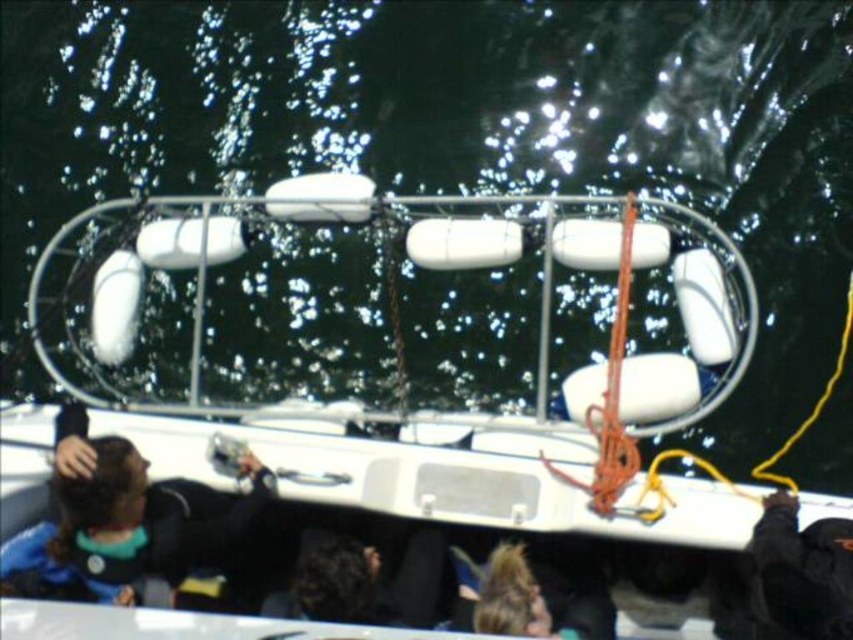
You are a passenger on the boat and want to retrieve your blue fabric jacket at lower left. However, there are white matte lifebuoys at center blocking your path. Can you walk around them to reach your jacket?

The white matte lifebuoys at center are in front of the blue fabric jacket at lower left, so you can walk around them to reach the blue fabric jacket at lower left.